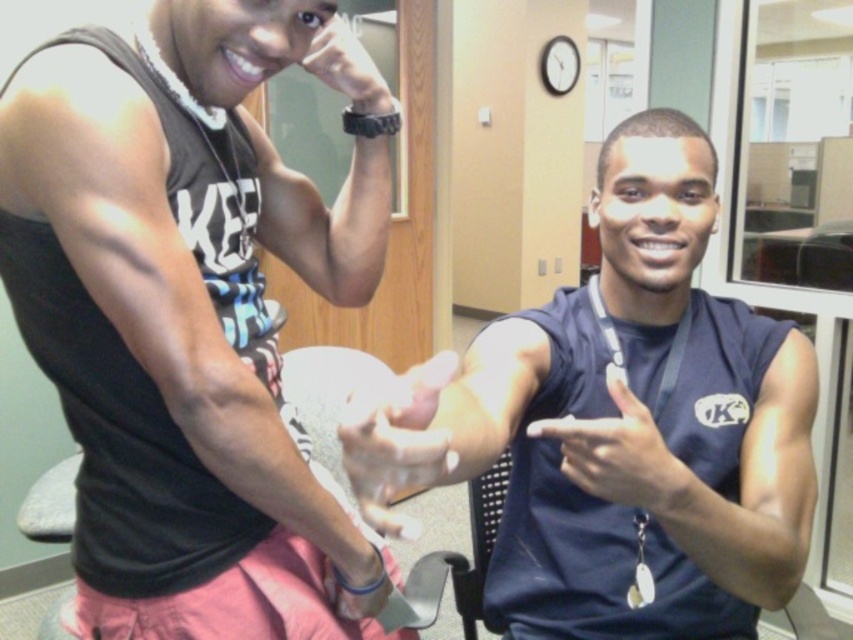
Question: Does navy blue sleeveless shirt at center have a greater width compared to smooth skin hand at center?

Choices:
 (A) yes
 (B) no

Answer: (A)

Question: Which object is positioned closest to the smooth skin hand at center?

Choices:
 (A) matte black watch at upper center
 (B) black matte tank top at left
 (C) matte black hand at center
 (D) navy blue sleeveless shirt at center

Answer: (C)

Question: Does black matte tank top at left appear under matte black hand at center?

Choices:
 (A) yes
 (B) no

Answer: (B)

Question: Which of the following is the farthest from the observer?

Choices:
 (A) (611, 476)
 (B) (552, 536)
 (C) (56, 108)

Answer: (B)

Question: Considering the relative positions of matte black hand at center and matte black watch at upper center in the image provided, where is matte black hand at center located with respect to matte black watch at upper center?

Choices:
 (A) below
 (B) above

Answer: (A)

Question: Which of the following is the farthest from the observer?

Choices:
 (A) (393, 378)
 (B) (310, 540)
 (C) (387, 90)
 (D) (607, 493)

Answer: (C)